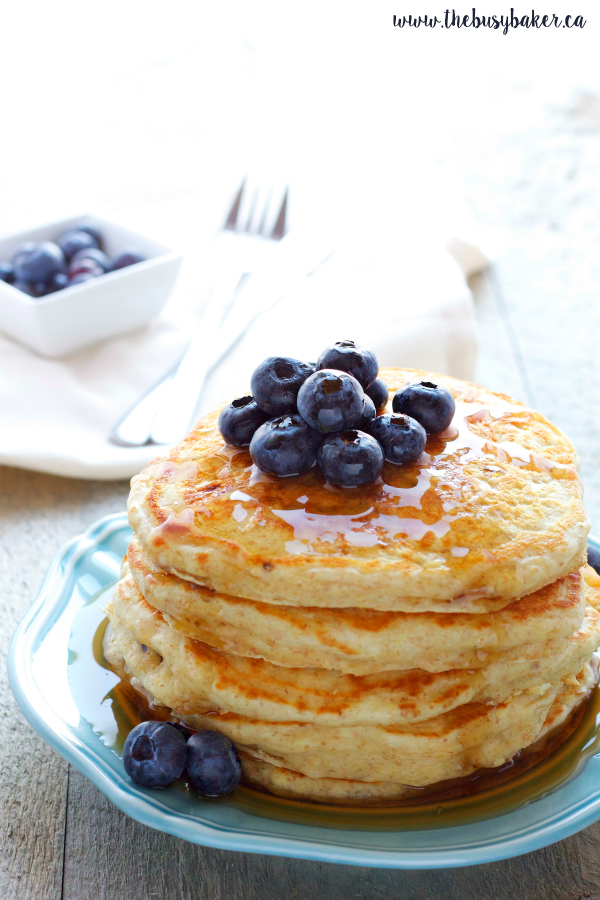
Where is `utensils`? utensils is located at coordinates click(x=201, y=357).